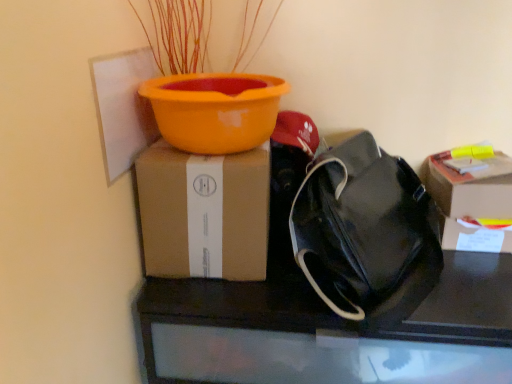
Question: In terms of width, does black leather bag at center look wider or thinner when compared to black leather handbag at right?

Choices:
 (A) thin
 (B) wide

Answer: (B)

Question: Is black leather bag at center in front of or behind black leather handbag at right in the image?

Choices:
 (A) behind
 (B) front

Answer: (A)

Question: Estimate the real-world distances between objects in this image. Which object is farther from the brown cardboard box at upper left, positioned as the second box in right-to-left order?

Choices:
 (A) black leather bag at center
 (B) cardboard box at right, which appears as the 1th box when viewed from the right
 (C) black leather handbag at right

Answer: (B)

Question: Considering the real-world distances, which object is closest to the black leather handbag at right?

Choices:
 (A) cardboard box at right, arranged as the second box when viewed from the left
 (B) black leather bag at center
 (C) brown cardboard box at upper left, which is counted as the 1th box, starting from the left

Answer: (B)